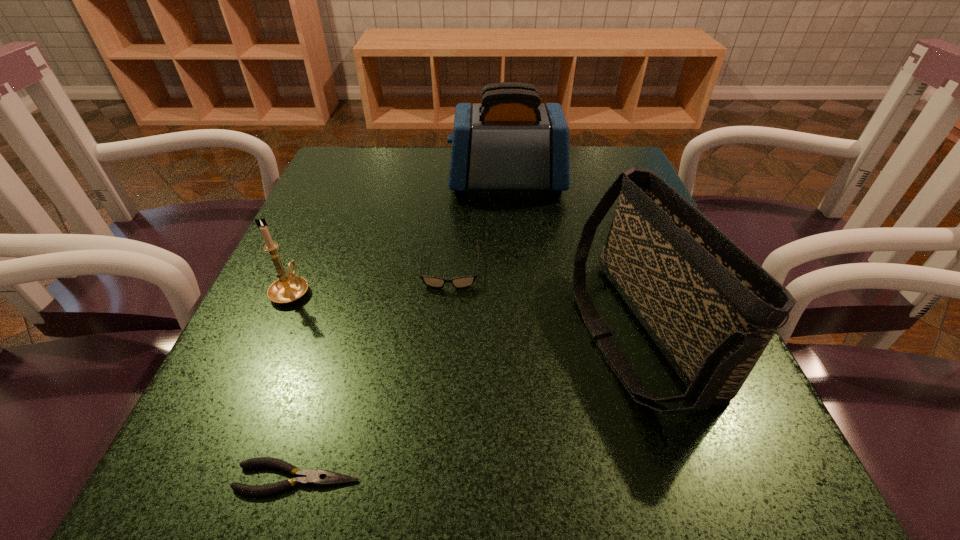
You are a GUI agent. You are given a task and a screenshot of the screen. Output one action in this format:
    pyautogui.click(x=<x>, y=<y>)
    Task: Click on the pliers present at the left edge
    
    Given the screenshot: What is the action you would take?
    pyautogui.click(x=307, y=477)

Identify the location of object at the right edge. This screenshot has width=960, height=540. (711, 309).

You are a GUI agent. You are given a task and a screenshot of the screen. Output one action in this format:
    pyautogui.click(x=<x>, y=<y>)
    Task: Click on the object located in the near left corner section of the desktop
    This screenshot has height=540, width=960.
    Given the screenshot: What is the action you would take?
    pyautogui.click(x=307, y=477)

Find the location of a particular element. object present at the near right corner is located at coordinates (711, 309).

This screenshot has height=540, width=960. In order to click on vacant point at the far edge in this screenshot , I will do `click(548, 192)`.

Identify the location of free space at the near edge of the desktop. This screenshot has width=960, height=540. click(357, 454).

This screenshot has width=960, height=540. I want to click on free location at the left edge of the desktop, so click(x=242, y=411).

In the image, there is a desktop. Where is `vacant space at the right edge`? The width and height of the screenshot is (960, 540). vacant space at the right edge is located at coordinates (602, 286).

Where is `vacant space at the far left corner of the desktop`? This screenshot has width=960, height=540. vacant space at the far left corner of the desktop is located at coordinates (332, 179).

Find the location of a particular element. free location at the near left corner of the desktop is located at coordinates (318, 437).